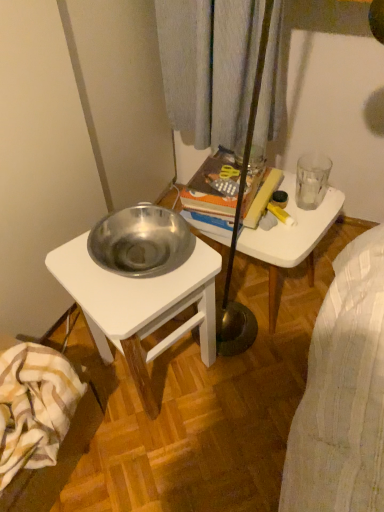
Question: Should I look upward or downward to see white glossy table at upper center?

Choices:
 (A) down
 (B) up

Answer: (B)

Question: Can you confirm if striped cotton blanket at lower left is bigger than transparent glass at upper right?

Choices:
 (A) no
 (B) yes

Answer: (B)

Question: Does striped cotton blanket at lower left have a greater width compared to transparent glass at upper right?

Choices:
 (A) no
 (B) yes

Answer: (B)

Question: Is the position of striped cotton blanket at lower left less distant than that of transparent glass at upper right?

Choices:
 (A) no
 (B) yes

Answer: (B)

Question: Is striped cotton blanket at lower left at the left side of transparent glass at upper right?

Choices:
 (A) no
 (B) yes

Answer: (B)

Question: From a real-world perspective, is striped cotton blanket at lower left positioned under transparent glass at upper right based on gravity?

Choices:
 (A) yes
 (B) no

Answer: (A)

Question: From a real-world perspective, is striped cotton blanket at lower left over transparent glass at upper right?

Choices:
 (A) yes
 (B) no

Answer: (B)

Question: Is polished silver bowl at left bigger than striped cotton blanket at lower left?

Choices:
 (A) yes
 (B) no

Answer: (A)

Question: Does polished silver bowl at left appear on the right side of striped cotton blanket at lower left?

Choices:
 (A) no
 (B) yes

Answer: (B)

Question: Is the position of polished silver bowl at left more distant than that of striped cotton blanket at lower left?

Choices:
 (A) no
 (B) yes

Answer: (B)

Question: Is polished silver bowl at left closer to camera compared to striped cotton blanket at lower left?

Choices:
 (A) yes
 (B) no

Answer: (B)

Question: From a real-world perspective, is polished silver bowl at left under striped cotton blanket at lower left?

Choices:
 (A) yes
 (B) no

Answer: (B)

Question: Considering the relative sizes of polished silver bowl at left and striped cotton blanket at lower left in the image provided, is polished silver bowl at left taller than striped cotton blanket at lower left?

Choices:
 (A) no
 (B) yes

Answer: (B)

Question: Is transparent glass at upper right to the right of white glossy table at upper center from the viewer's perspective?

Choices:
 (A) yes
 (B) no

Answer: (A)